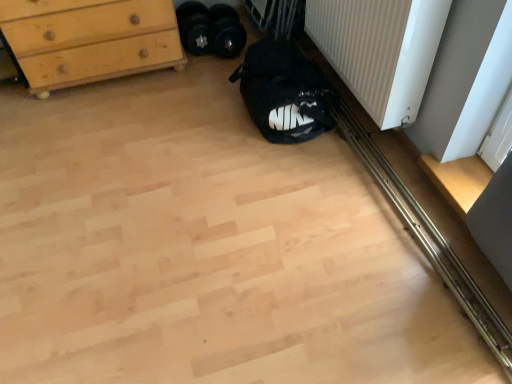
Question: From a real-world perspective, is light wood chest of drawers at upper left located higher than white ribbed radiator at lower right?

Choices:
 (A) yes
 (B) no

Answer: (B)

Question: Considering the relative sizes of light wood chest of drawers at upper left and white ribbed radiator at lower right in the image provided, is light wood chest of drawers at upper left taller than white ribbed radiator at lower right?

Choices:
 (A) no
 (B) yes

Answer: (A)

Question: Is light wood chest of drawers at upper left in front of white ribbed radiator at lower right?

Choices:
 (A) yes
 (B) no

Answer: (B)

Question: From the image's perspective, is light wood chest of drawers at upper left above white ribbed radiator at lower right?

Choices:
 (A) no
 (B) yes

Answer: (B)

Question: Considering the relative positions of light wood chest of drawers at upper left and white ribbed radiator at lower right in the image provided, is light wood chest of drawers at upper left to the left of white ribbed radiator at lower right from the viewer's perspective?

Choices:
 (A) yes
 (B) no

Answer: (A)

Question: Would you consider light wood chest of drawers at upper left to be distant from white ribbed radiator at lower right?

Choices:
 (A) yes
 (B) no

Answer: (A)

Question: From the image's perspective, would you say black fabric shoe at center, which appears as the 1th footwear when viewed from the right, is shown under black rubber weights at center, marked as the 2th footwear in a right-to-left arrangement?

Choices:
 (A) no
 (B) yes

Answer: (B)

Question: Considering the relative positions of black fabric shoe at center, which appears as the 2th footwear when viewed from the left, and black rubber weights at center, positioned as the first footwear in left-to-right order, in the image provided, is black fabric shoe at center, which appears as the 2th footwear when viewed from the left, to the right of black rubber weights at center, positioned as the first footwear in left-to-right order, from the viewer's perspective?

Choices:
 (A) no
 (B) yes

Answer: (B)

Question: Does black fabric shoe at center, which appears as the 1th footwear when viewed from the right, contain black rubber weights at center, positioned as the first footwear in left-to-right order?

Choices:
 (A) yes
 (B) no

Answer: (A)

Question: Considering the relative sizes of black fabric shoe at center, which appears as the 2th footwear when viewed from the left, and black rubber weights at center, marked as the 2th footwear in a right-to-left arrangement, in the image provided, is black fabric shoe at center, which appears as the 2th footwear when viewed from the left, thinner than black rubber weights at center, marked as the 2th footwear in a right-to-left arrangement,?

Choices:
 (A) no
 (B) yes

Answer: (A)

Question: Does black fabric shoe at center, which appears as the 1th footwear when viewed from the right, have a smaller size compared to black rubber weights at center, positioned as the first footwear in left-to-right order?

Choices:
 (A) yes
 (B) no

Answer: (B)

Question: From a real-world perspective, is black fabric shoe at center, which appears as the 1th footwear when viewed from the right, physically above black rubber weights at center, marked as the 2th footwear in a right-to-left arrangement?

Choices:
 (A) no
 (B) yes

Answer: (B)

Question: Does black fabric sleeping bag at lower center have a larger size compared to black rubber weights at center, positioned as the first footwear in left-to-right order?

Choices:
 (A) no
 (B) yes

Answer: (B)